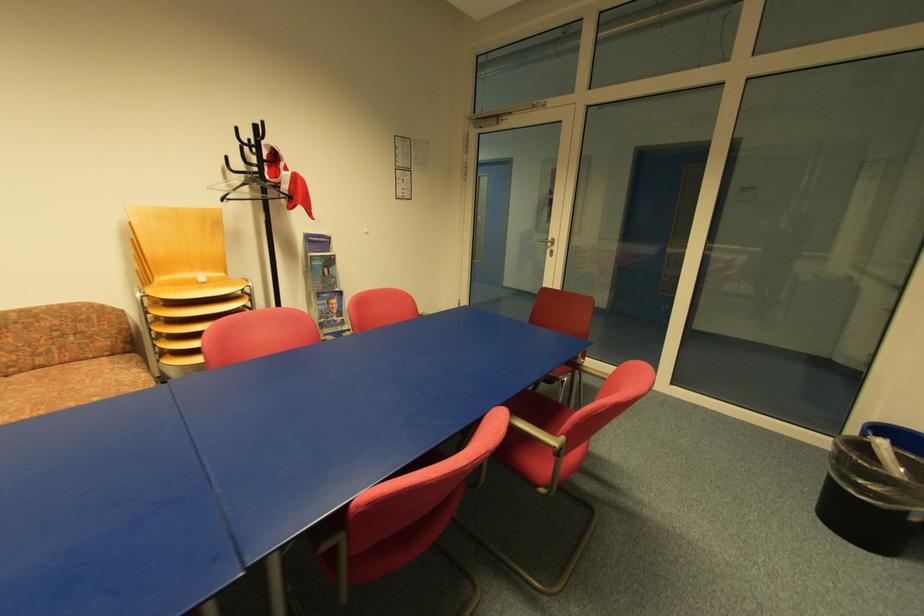
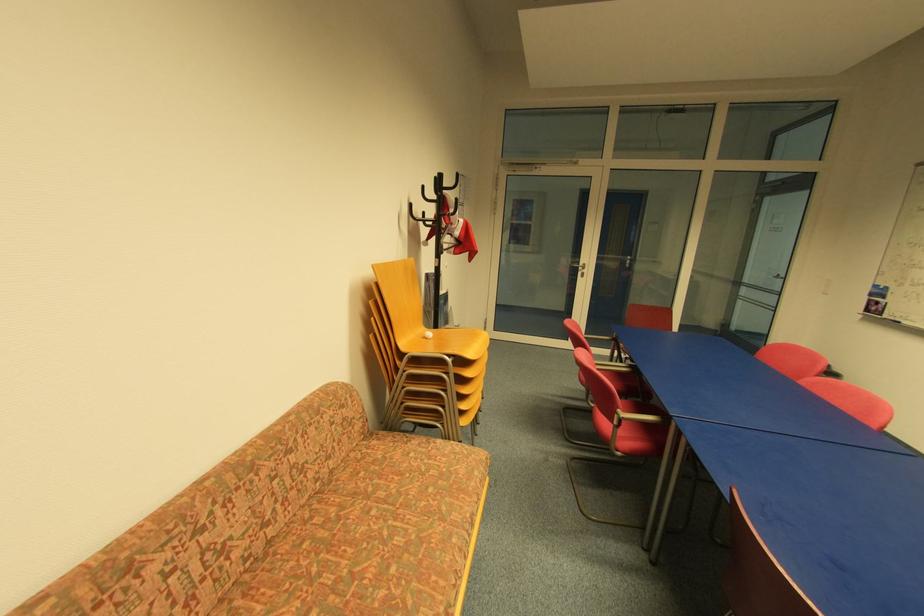
Where in the second image is the point corresponding to point (112, 355) from the first image?

(367, 438)